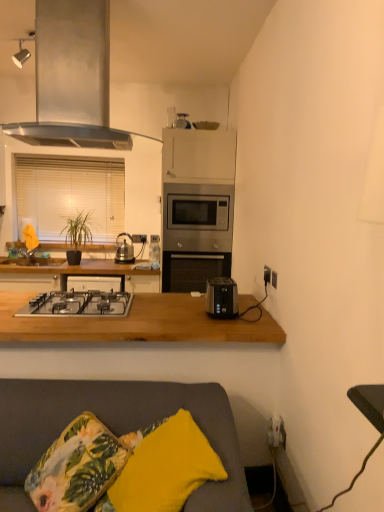
Locate an element on the screen. This screenshot has height=512, width=384. vacant space to the left of black plastic toaster at right is located at coordinates (187, 312).